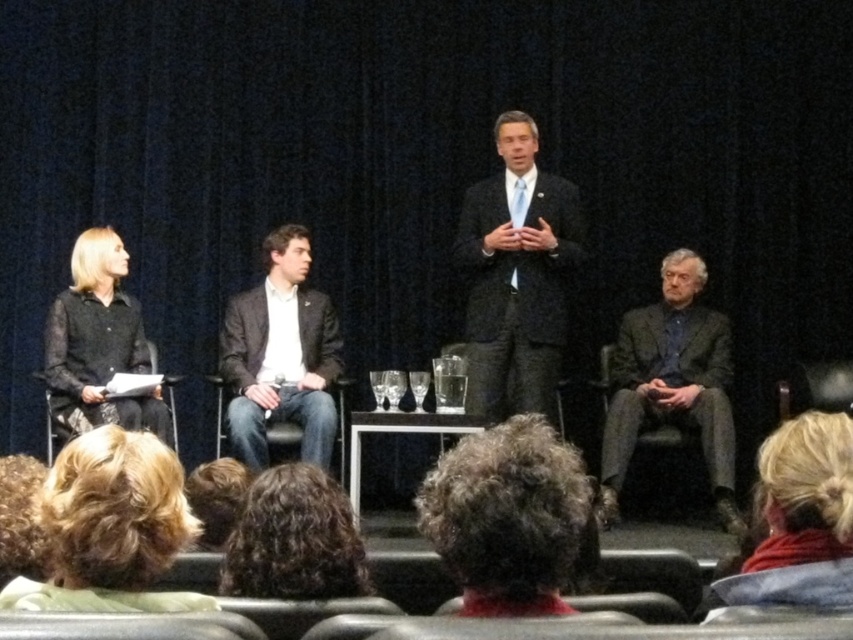
You are an attendee in the audience looking at the stage. Where is the black textured blouse at left located in terms of its 2D coordinates?

The black textured blouse at left is located at the 2D coordinates point (97, 342).

You are an event photographer trying to capture a clear photo of the dark curly hair at center and the blonde hair at lower right. Based on their positions, which of the two individuals is seated higher on the stage?

The dark curly hair at center is seated higher on the stage because it is positioned above the blonde hair at lower right.

You are an event organizer trying to arrange name tags for the panelists. You have two name tags to place on the stage. The name tags must be placed either above or below the panelists. Considering the spatial arrangement, where should you place the name tag for the person in the dark gray suit at right and the one with blonde hair at lower right?

The dark gray suit at right is taller than the blonde hair at lower right. Therefore, the name tag for the dark gray suit at right should be placed below to avoid blocking the view, while the name tag for the blonde hair at lower right can be placed above since it is shorter.